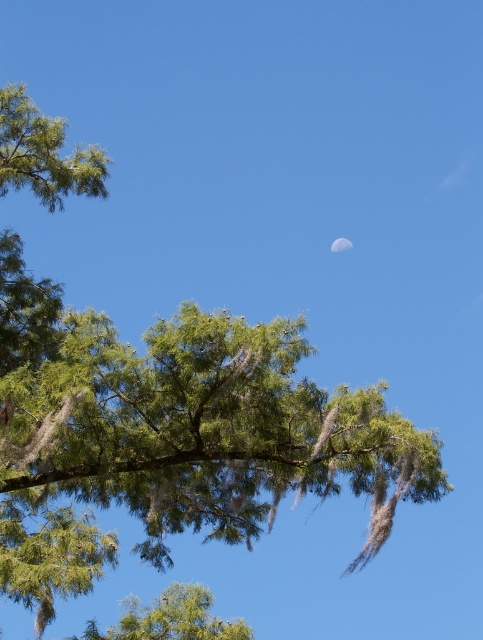
Question: Is green leafy tree at lower center positioned behind silvery reflective moon at upper center?

Choices:
 (A) yes
 (B) no

Answer: (B)

Question: Is green leafy tree at lower center to the right of silvery reflective moon at upper center from the viewer's perspective?

Choices:
 (A) no
 (B) yes

Answer: (A)

Question: Which point appears closest to the camera in this image?

Choices:
 (A) (189, 604)
 (B) (336, 248)

Answer: (A)

Question: Does green leafy tree at lower center appear under silvery reflective moon at upper center?

Choices:
 (A) yes
 (B) no

Answer: (A)